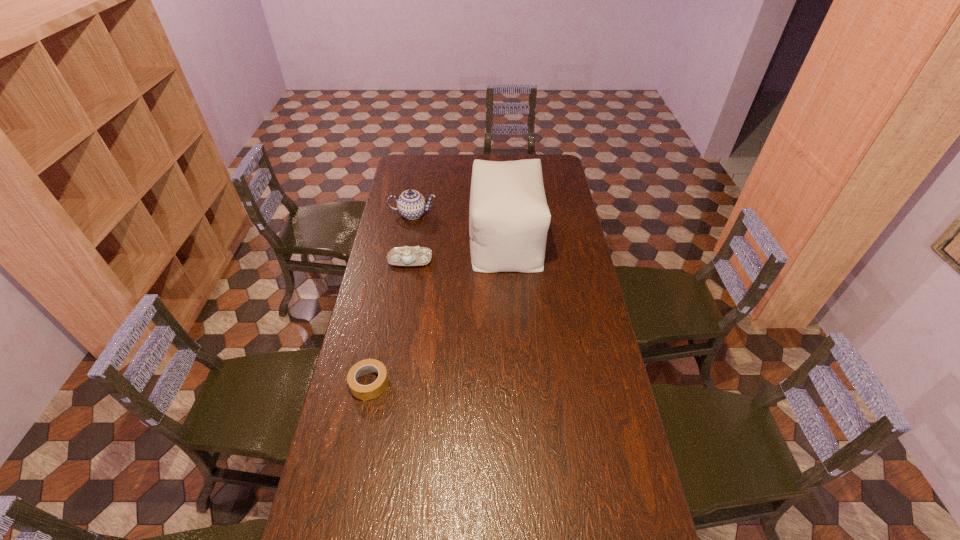
The height and width of the screenshot is (540, 960). Identify the location of free space located on the side of the tallest object with the smiley face. (405, 240).

Where is `vacant space located 0.170m at the spout of the taller chinaware`? vacant space located 0.170m at the spout of the taller chinaware is located at coordinates (407, 246).

Identify the location of free spot located 0.290m on the back of the nearer chinaware. click(419, 211).

Where is `free region located 0.220m at the edge of the duct tape`? Image resolution: width=960 pixels, height=540 pixels. free region located 0.220m at the edge of the duct tape is located at coordinates (351, 471).

At what (x,y) coordinates should I click in order to perform the action: click on duct tape positioned at the left edge. Please return your answer as a coordinate pair (x, y). Looking at the image, I should click on (364, 392).

The width and height of the screenshot is (960, 540). What are the coordinates of `free space at the left edge` in the screenshot? It's located at (372, 404).

Identify the location of free space at the right edge. (554, 221).

The image size is (960, 540). In the image, there is a desktop. Find the location of `blank space at the far left corner`. blank space at the far left corner is located at coordinates (405, 175).

The height and width of the screenshot is (540, 960). What are the coordinates of `vacant space at the far right corner of the desktop` in the screenshot? It's located at (540, 158).

Image resolution: width=960 pixels, height=540 pixels. In order to click on free area in between the second shortest object and the duct tape in this screenshot , I will do `click(390, 322)`.